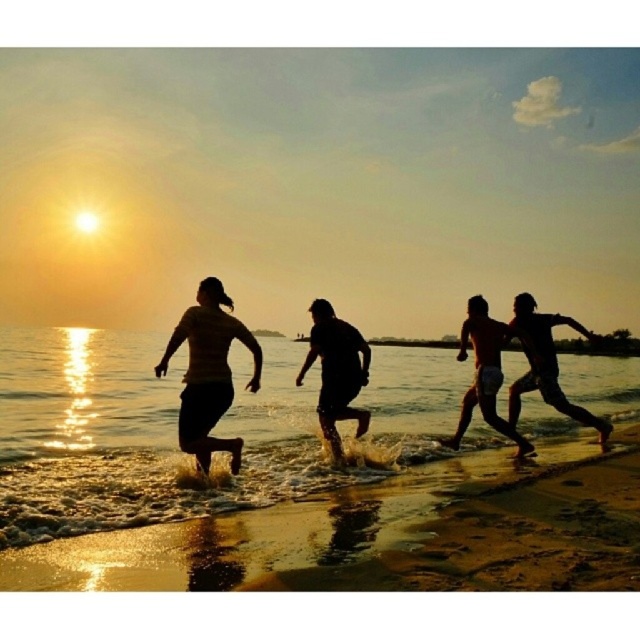
You are standing at the point marked by the coordinates point (362, 532). Looking towards the direction of the sunset, which direction should you walk to reach the sandy beach at lower right?

The sandy beach at lower right is already at the coordinates point (362, 532), so you are already standing on it.

You are standing at point (337, 371) on the beach. What do you see directly in front of you?

You see a dark matte figure at center directly in front of you at point (337, 371).

You are a photographer trying to capture the sunset on the sandy beach at lower right. To ensure the beach is centered in your photo, where should you position your camera? Please provide coordinates in the format of a point like this example format of point coordinates. The scene is from the photographer standing at the origin point at the center of the image.

The sandy beach at lower right is located at point coordinates [362,532]. To center it in your photo, position your camera at those coordinates.